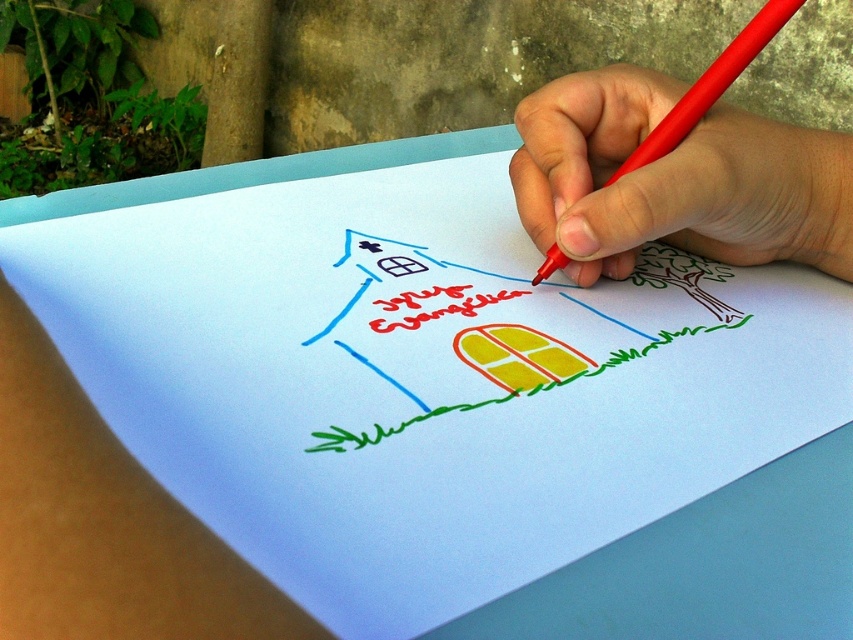
You are an artist holding a smooth red pen at upper right and want to draw on the white paper at center. Can you reach the paper without moving your hand?

The smooth red pen at upper right is 2.91 inches away from the white paper at center. Since this distance is within typical hand reach, you can likely reach the white paper at center without moving your hand.

Consider the image. You are an artist holding a smooth red pen at upper right. You want to sign your artwork with your name. Can you reach the bottom of the paper without moving your hand? The paper is 14 inches long.

The smooth red pen at upper right is 12.39 inches away from viewer, so yes, you can reach the bottom of the paper since it is shorter than the paper length.

You are an artist who needs to sign your artwork. You see the smooth red pen at upper right and the white paper at center. Where should you place the pen to sign below the drawing?

The smooth red pen at upper right is positioned over the white paper at center, so you can move it down to sign below the drawing.